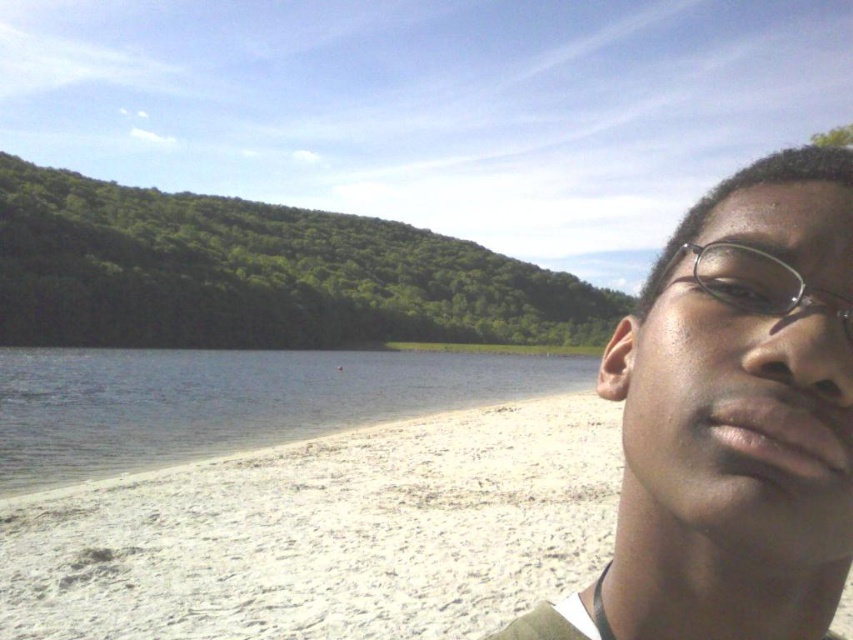
You are standing at the point closer to the camera between the two points, point (318, 404) and point (660, 275). Which point are you standing at?

You are standing at point (318, 404) because it is further to the camera than point (660, 275).

You are standing at the center of the image and want to walk to the white sandy beach at lower left. In which direction should you move?

You should move to the lower left direction to reach the white sandy beach at lower left since it is located at point (326, 532).

You are a photographer trying to capture the clear plastic glasses at upper right and the clear water at lower left in a single shot. Which object will occupy more space in your photo?

The clear water at lower left is bigger than the clear plastic glasses at upper right, so it will occupy more space in the photo.